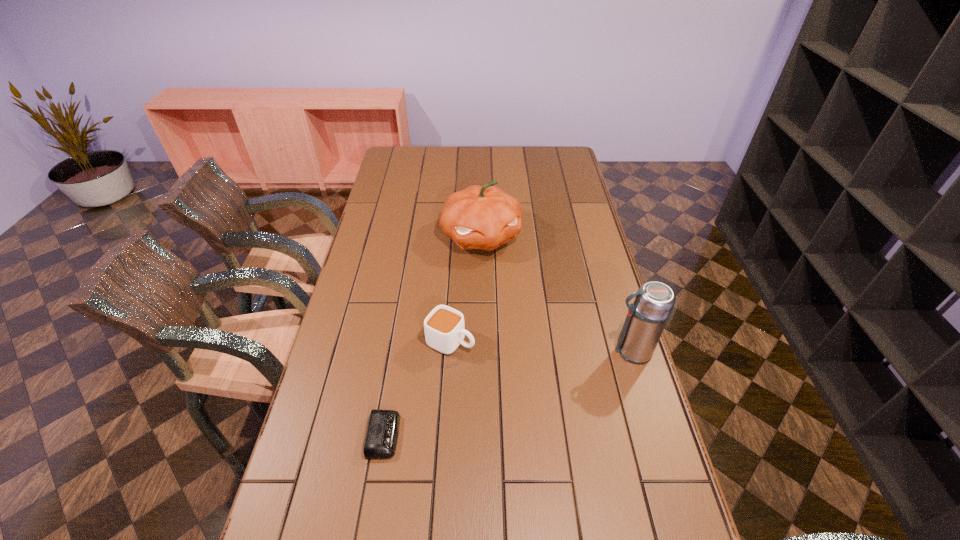
Where is `vacant space at the near left corner of the desktop`? Image resolution: width=960 pixels, height=540 pixels. vacant space at the near left corner of the desktop is located at coordinates (300, 510).

Locate an element on the screen. This screenshot has height=540, width=960. vacant space at the near right corner is located at coordinates (639, 526).

Find the location of `unoccupied position between the farthest object and the rightmost object`. unoccupied position between the farthest object and the rightmost object is located at coordinates (556, 294).

The image size is (960, 540). Find the location of `vacant point located between the thermos bottle and the cup`. vacant point located between the thermos bottle and the cup is located at coordinates (540, 346).

This screenshot has width=960, height=540. What are the coordinates of `free space between the rightmost object and the nearest object` in the screenshot? It's located at (508, 393).

This screenshot has height=540, width=960. I want to click on vacant area between the rightmost object and the alarm clock, so click(x=508, y=393).

Locate an element on the screen. empty location between the alarm clock and the second shortest object is located at coordinates (418, 388).

The width and height of the screenshot is (960, 540). I want to click on vacant space in between the thermos bottle and the cup, so click(x=540, y=346).

Find the location of a particular element. The image size is (960, 540). free space between the nearest object and the second shortest object is located at coordinates (418, 388).

In order to click on object that can be found as the second closest to the shortest object in this screenshot , I will do (x=485, y=217).